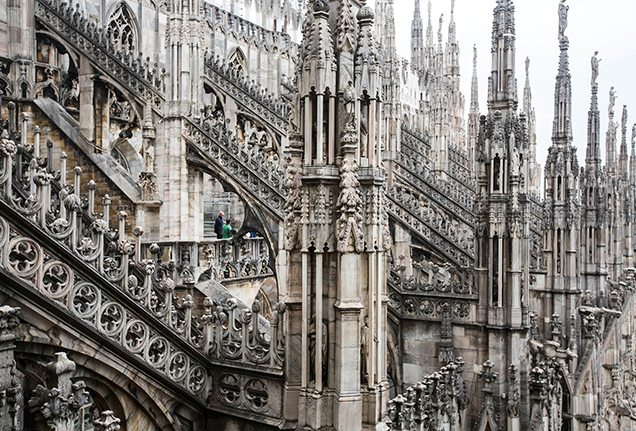
The width and height of the screenshot is (636, 431). In order to click on pillar in this screenshot , I will do `click(604, 324)`.